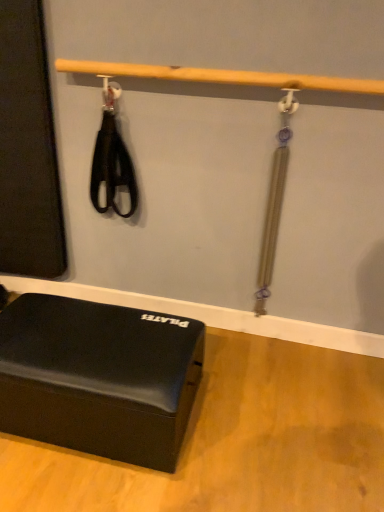
Where is `matte black foam block at lower left`? matte black foam block at lower left is located at coordinates (99, 378).

Image resolution: width=384 pixels, height=512 pixels. What do you see at coordinates (99, 378) in the screenshot?
I see `matte black foam block at lower left` at bounding box center [99, 378].

The height and width of the screenshot is (512, 384). In order to click on wooden bar at upper center in this screenshot , I will do `click(222, 76)`.

Measure the distance between wooden bar at upper center and camera.

They are 1.20 meters apart.

Describe the element at coordinates (222, 76) in the screenshot. I see `wooden bar at upper center` at that location.

Where is `matte black foam block at lower left`? This screenshot has height=512, width=384. matte black foam block at lower left is located at coordinates (99, 378).

Between matte black foam block at lower left and wooden bar at upper center, which one appears on the right side from the viewer's perspective?

wooden bar at upper center is more to the right.

Which object is further away from the camera, matte black foam block at lower left or wooden bar at upper center?

wooden bar at upper center is further from the camera.

Is point (177, 454) closer to viewer compared to point (107, 69)?

Yes, point (177, 454) is closer to viewer.

From the image's perspective, which one is positioned higher, matte black foam block at lower left or wooden bar at upper center?

wooden bar at upper center is shown above in the image.

From a real-world perspective, which is physically below, matte black foam block at lower left or wooden bar at upper center?

In real-world perspective, matte black foam block at lower left is lower.

Which object is wider, matte black foam block at lower left or wooden bar at upper center?

Wider between the two is matte black foam block at lower left.

Can you confirm if matte black foam block at lower left is taller than wooden bar at upper center?

Indeed, matte black foam block at lower left has a greater height compared to wooden bar at upper center.

Which of these two, matte black foam block at lower left or wooden bar at upper center, is bigger?

matte black foam block at lower left.

Is wooden bar at upper center completely or partially inside matte black foam block at lower left?

No, matte black foam block at lower left does not contain wooden bar at upper center.

Looking at this image, is matte black foam block at lower left far away from wooden bar at upper center?

No, matte black foam block at lower left is not far from wooden bar at upper center.

Is matte black foam block at lower left oriented towards wooden bar at upper center?

No, matte black foam block at lower left is not oriented towards wooden bar at upper center.

What's the angular difference between matte black foam block at lower left and wooden bar at upper center's facing directions?

The facing directions of matte black foam block at lower left and wooden bar at upper center are 0.28 degrees apart.

The width and height of the screenshot is (384, 512). I want to click on beam behind the matte black foam block at lower left, so click(222, 76).

Based on their positions, is wooden bar at upper center located to the left or right of matte black foam block at lower left?

Based on their positions, wooden bar at upper center is located to the right of matte black foam block at lower left.

Which is behind, wooden bar at upper center or matte black foam block at lower left?

wooden bar at upper center is more distant.

Is point (247, 77) closer to camera compared to point (151, 416)?

No, it is not.

From the image's perspective, is wooden bar at upper center below matte black foam block at lower left?

No.

From a real-world perspective, is wooden bar at upper center on matte black foam block at lower left?

Yes, from a real-world perspective, wooden bar at upper center is over matte black foam block at lower left

Can you confirm if wooden bar at upper center is thinner than matte black foam block at lower left?

Yes, wooden bar at upper center is thinner than matte black foam block at lower left.

Does wooden bar at upper center have a greater height compared to matte black foam block at lower left?

Incorrect, the height of wooden bar at upper center is not larger of that of matte black foam block at lower left.

Between wooden bar at upper center and matte black foam block at lower left, which one has larger size?

Bigger between the two is matte black foam block at lower left.

Is matte black foam block at lower left surrounded by wooden bar at upper center?

No.

Is wooden bar at upper center directly adjacent to matte black foam block at lower left?

No, wooden bar at upper center is not in contact with matte black foam block at lower left.

Is wooden bar at upper center turned away from matte black foam block at lower left?

wooden bar at upper center does not have its back to matte black foam block at lower left.

How different are the orientations of wooden bar at upper center and matte black foam block at lower left in degrees?

They differ by 0.28 degrees in their facing directions.

Where is `furniture in front of the wooden bar at upper center`? The image size is (384, 512). furniture in front of the wooden bar at upper center is located at coordinates (99, 378).

Locate an element on the screen. This screenshot has width=384, height=512. furniture located on the left of wooden bar at upper center is located at coordinates (99, 378).

Where is `beam that is on the right side of matte black foam block at lower left`? The width and height of the screenshot is (384, 512). beam that is on the right side of matte black foam block at lower left is located at coordinates (222, 76).